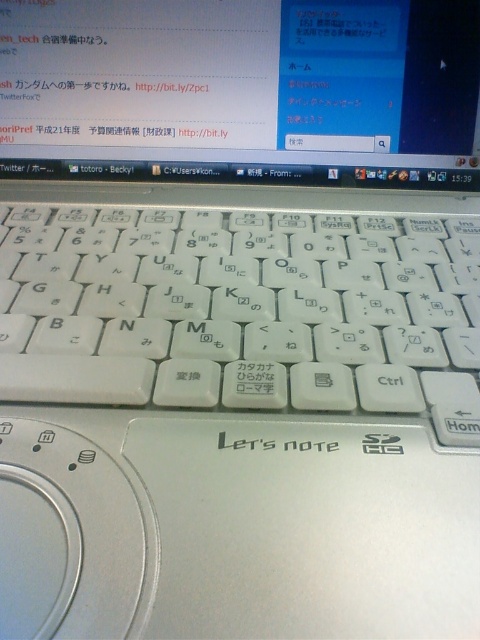
Can you confirm if white plastic keyboard at center is taller than matte white monitor at center?

Indeed, white plastic keyboard at center has a greater height compared to matte white monitor at center.

This screenshot has height=640, width=480. I want to click on white plastic keyboard at center, so click(x=242, y=310).